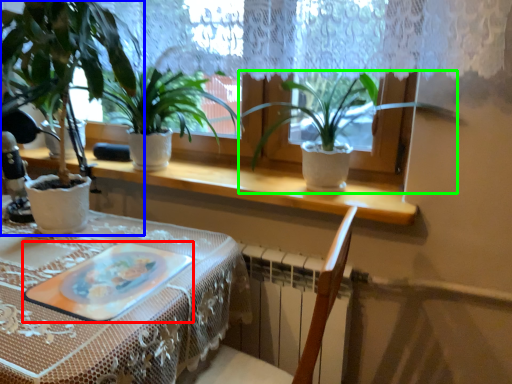
Question: Which object is the farthest from platter (highlighted by a red box)? Choose among these: houseplant (highlighted by a blue box) or houseplant (highlighted by a green box).

Choices:
 (A) houseplant
 (B) houseplant

Answer: (B)